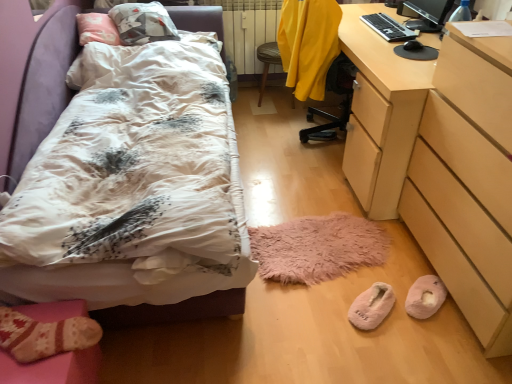
Find the location of a particular element. Image resolution: width=512 pixels, height=384 pixels. blank area beneath black plastic keyboard at upper right (from a real-world perspective) is located at coordinates (389, 24).